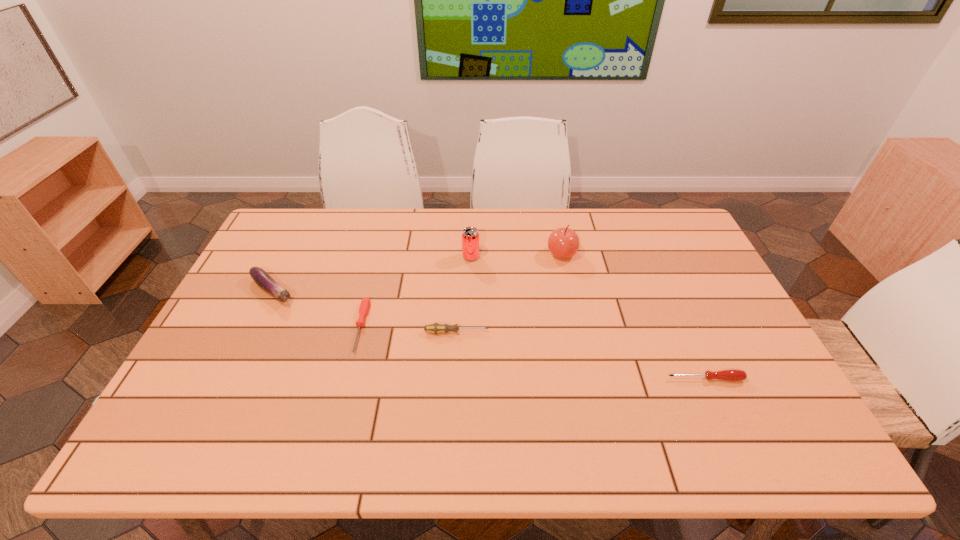
You are a GUI agent. You are given a task and a screenshot of the screen. Output one action in this format:
    pyautogui.click(x=<x>, y=<y>)
    Task: Click on the vacant position at the near left corner of the desktop
    This screenshot has height=540, width=960.
    Given the screenshot: What is the action you would take?
    198,454

You are a GUI agent. You are given a task and a screenshot of the screen. Output one action in this format:
    pyautogui.click(x=<x>, y=<y>)
    Task: Click on the vacant space at the near right corner of the desktop
    
    Given the screenshot: What is the action you would take?
    pyautogui.click(x=744, y=429)

Locate an element on the screen. The image size is (960, 540). empty space that is in between the shortest screwdriver and the fourth shortest object is located at coordinates (316, 309).

Identify the location of free point between the fifth object from right to left and the apple. (462, 291).

Image resolution: width=960 pixels, height=540 pixels. What are the coordinates of `empty location between the leftmost object and the nearest screwdriver` in the screenshot? It's located at (489, 335).

Find the location of a particular element. vacant area that lies between the soda can and the apple is located at coordinates (516, 255).

Where is `empty space between the fifth object from left to right and the rightmost object`? empty space between the fifth object from left to right and the rightmost object is located at coordinates (634, 316).

Where is `unoccupied area between the fifth object from left to right and the leftmost screwdriver`? The height and width of the screenshot is (540, 960). unoccupied area between the fifth object from left to right and the leftmost screwdriver is located at coordinates (462, 291).

Locate an element on the screen. The width and height of the screenshot is (960, 540). vacant space in between the fifth object from left to right and the shortest object is located at coordinates (462, 291).

Find the location of a particular element. This screenshot has width=960, height=540. free space between the second screwdriver from right to left and the rightmost screwdriver is located at coordinates (581, 355).